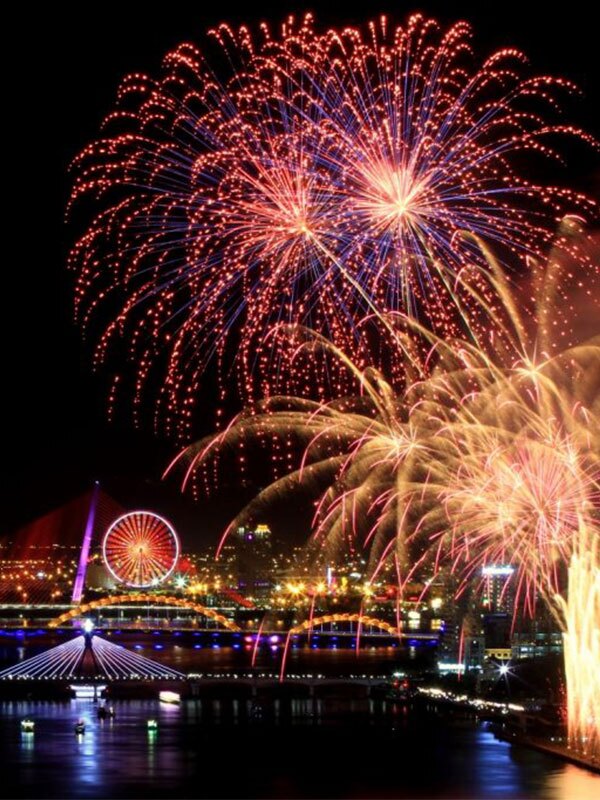
Find the location of a particular element. Image resolution: width=600 pixels, height=800 pixels. lights (in windows) is located at coordinates (231, 560).